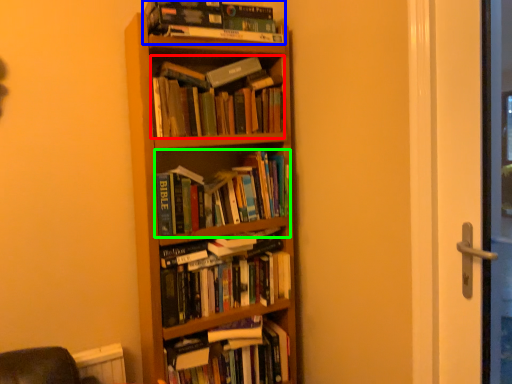
Question: Which is nearer to the book (highlighted by a red box)? book (highlighted by a blue box) or book (highlighted by a green box).

Choices:
 (A) book
 (B) book

Answer: (A)